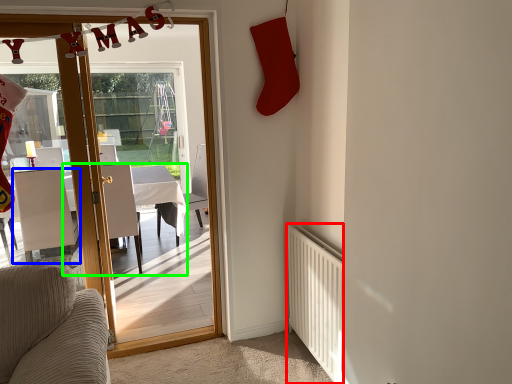
Question: Considering the real-world distances, which object is closest to radiator (highlighted by a red box)? chair (highlighted by a blue box) or table (highlighted by a green box).

Choices:
 (A) chair
 (B) table

Answer: (B)